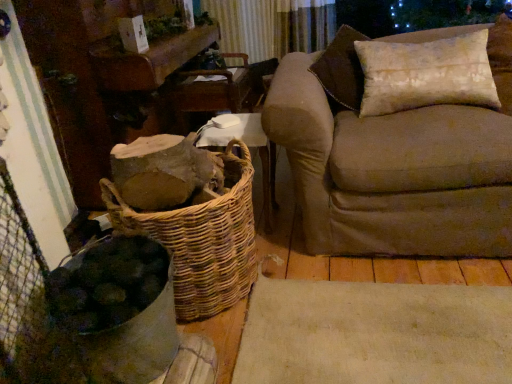
Question: Is wooden armchair at center at the back of woven wood basket at center?

Choices:
 (A) no
 (B) yes

Answer: (B)

Question: From a real-world perspective, is woven wood basket at center under wooden armchair at center?

Choices:
 (A) yes
 (B) no

Answer: (A)

Question: Is woven wood basket at center to the left of wooden armchair at center from the viewer's perspective?

Choices:
 (A) no
 (B) yes

Answer: (A)

Question: Is woven wood basket at center thinner than wooden armchair at center?

Choices:
 (A) no
 (B) yes

Answer: (B)

Question: Would you say woven wood basket at center is a long distance from wooden armchair at center?

Choices:
 (A) yes
 (B) no

Answer: (B)

Question: Is woven brown basket at lower left wider or thinner than beige fabric couch at right?

Choices:
 (A) wide
 (B) thin

Answer: (B)

Question: From the image's perspective, is woven brown basket at lower left positioned above or below beige fabric couch at right?

Choices:
 (A) above
 (B) below

Answer: (B)

Question: Is woven brown basket at lower left situated inside beige fabric couch at right or outside?

Choices:
 (A) outside
 (B) inside

Answer: (A)

Question: Is woven brown basket at lower left to the left or to the right of beige fabric couch at right in the image?

Choices:
 (A) left
 (B) right

Answer: (A)

Question: Considering the relative positions of wooden armchair at center and woven brown basket at lower left in the image provided, is wooden armchair at center to the left or to the right of woven brown basket at lower left?

Choices:
 (A) right
 (B) left

Answer: (B)

Question: From the image's perspective, is wooden armchair at center above or below woven brown basket at lower left?

Choices:
 (A) above
 (B) below

Answer: (A)

Question: In terms of size, does wooden armchair at center appear bigger or smaller than woven brown basket at lower left?

Choices:
 (A) big
 (B) small

Answer: (B)

Question: Is wooden armchair at center spatially inside woven brown basket at lower left, or outside of it?

Choices:
 (A) outside
 (B) inside

Answer: (A)

Question: Is point (317, 125) closer or farther from the camera than point (233, 77)?

Choices:
 (A) farther
 (B) closer

Answer: (B)

Question: Considering the positions of beige fabric couch at right and wooden armchair at center in the image, is beige fabric couch at right taller or shorter than wooden armchair at center?

Choices:
 (A) tall
 (B) short

Answer: (A)